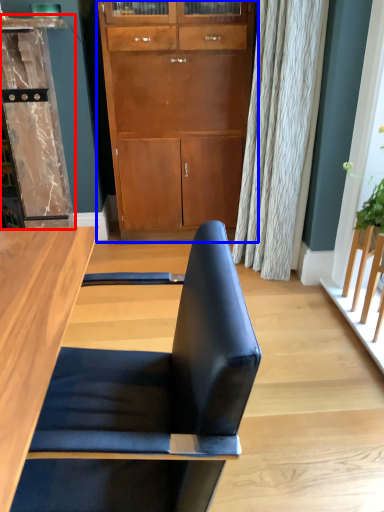
Question: Which point is closer to the camera, dresser (highlighted by a red box) or cabinetry (highlighted by a blue box)?

Choices:
 (A) dresser
 (B) cabinetry

Answer: (A)